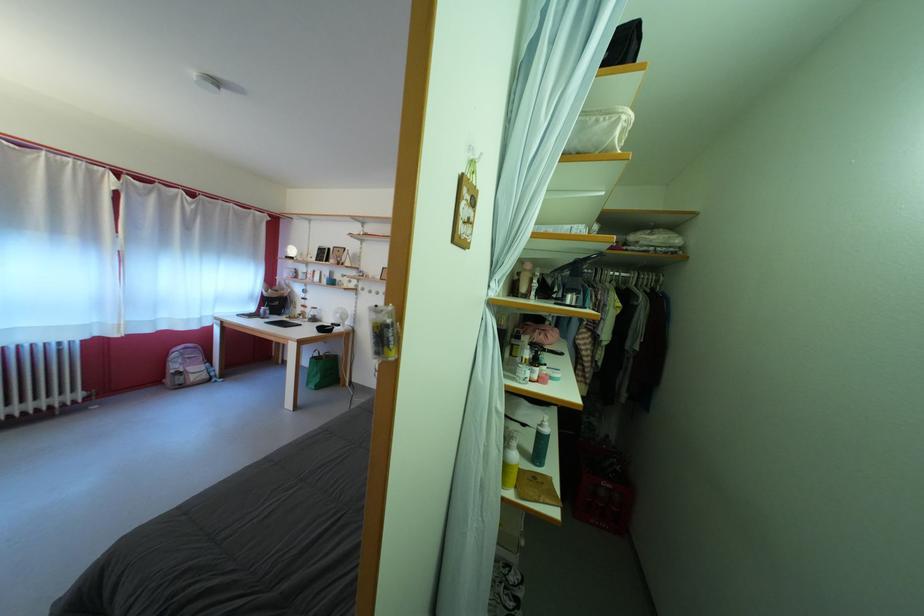
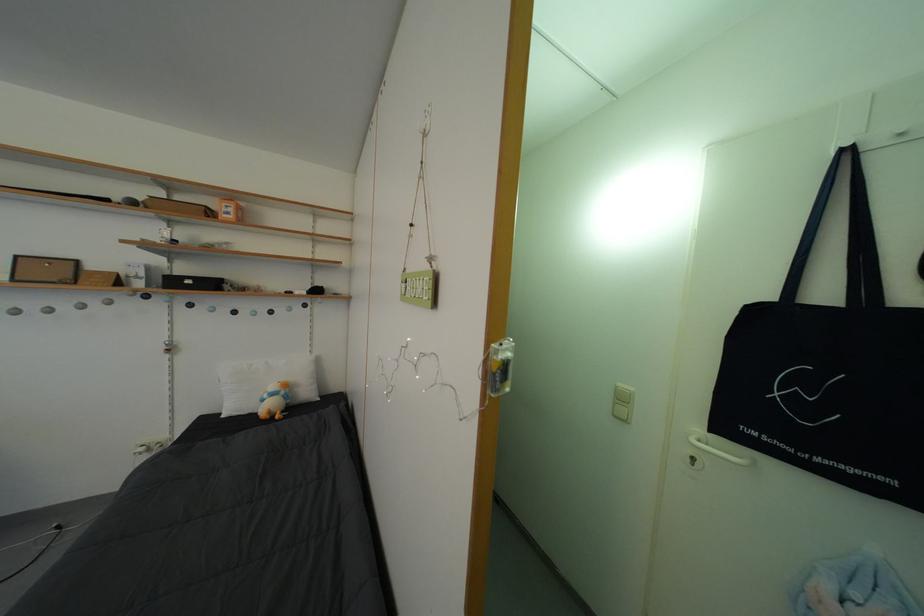
Question: Based on the continuous images, in which direction is the camera rotating? Reply with the corresponding letter.

Choices:
 (A) Left
 (B) Right
 (C) Up
 (D) Down

Answer: (B)